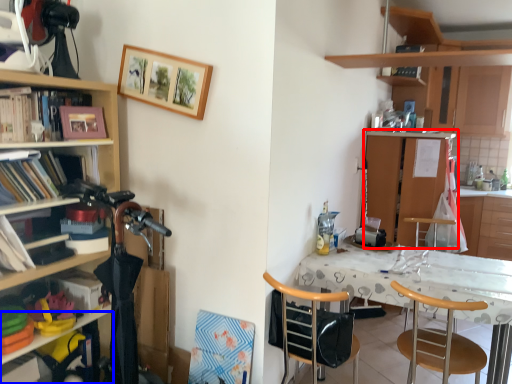
Question: Among these objects, which one is nearest to the camera, cabinetry (highlighted by a red box) or shelf (highlighted by a blue box)?

Choices:
 (A) cabinetry
 (B) shelf

Answer: (B)